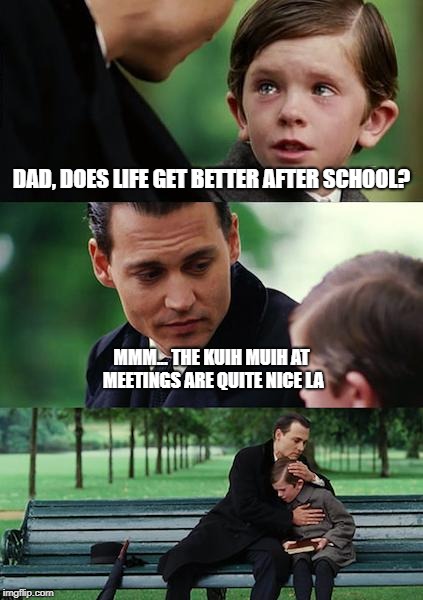
I want to click on bench, so click(x=117, y=525).